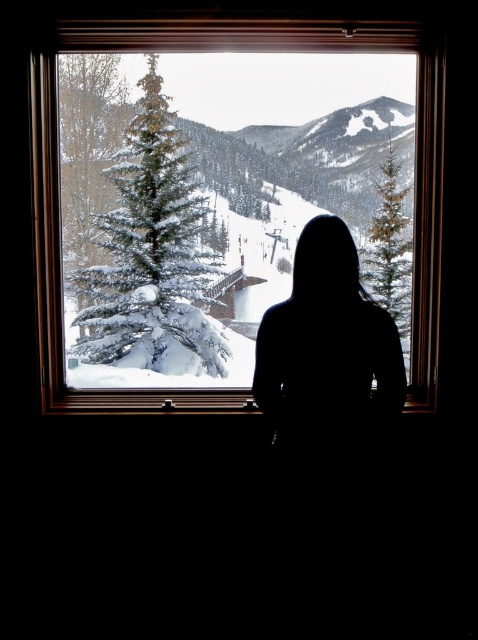
Does snow-covered evergreen at center come behind wooden frame at center?

Yes, it is behind wooden frame at center.

Identify the location of snow-covered evergreen at center. (143, 246).

I want to click on snow-covered evergreen at center, so click(143, 246).

Who is higher up, silhouette figure at center or green textured pine at right?

green textured pine at right is above.

Between point (336, 358) and point (368, 120), which one is positioned in front?

Point (336, 358) is more forward.

Find the location of a particular element. silhouette figure at center is located at coordinates (326, 337).

You are a GUI agent. You are given a task and a screenshot of the screen. Output one action in this format:
    pyautogui.click(x=<x>, y=<y>)
    Task: Click on the silhouette figure at center
    The image size is (478, 640).
    Given the screenshot: What is the action you would take?
    pyautogui.click(x=326, y=337)

Is point (180, 256) farther from viewer compared to point (274, 403)?

Yes, it is.

Which of these two, snow-covered evergreen at center or silhouette figure at center, stands shorter?

silhouette figure at center

Describe the element at coordinates (143, 246) in the screenshot. This screenshot has height=640, width=478. I see `snow-covered evergreen at center` at that location.

This screenshot has width=478, height=640. Find the location of `snow-covered evergreen at center`. snow-covered evergreen at center is located at coordinates (143, 246).